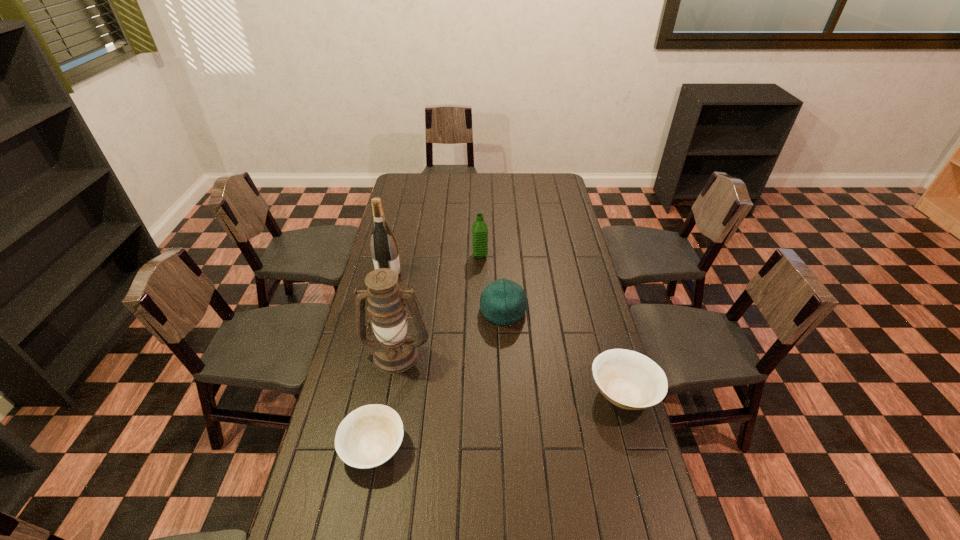
You are a GUI agent. You are given a task and a screenshot of the screen. Output one action in this format:
    pyautogui.click(x=<x>, y=<y>)
    Task: Click on the vacant space located 0.310m on the right of the shorter bowl
    
    Given the screenshot: What is the action you would take?
    pyautogui.click(x=516, y=448)

Where is `free space located on the back of the taller bowl`? This screenshot has width=960, height=540. free space located on the back of the taller bowl is located at coordinates tap(592, 285).

The image size is (960, 540). Identify the location of vacant space situated on the label of the fifth nearest object. (479, 275).

Find the location of a particular element. This screenshot has width=960, height=540. free space located on the left of the farthest object is located at coordinates (385, 255).

At what (x,y) coordinates should I click in order to perform the action: click on vacant area situated on the right of the fourth tallest object. Please return your answer as a coordinate pair (x, y). Image resolution: width=960 pixels, height=540 pixels. Looking at the image, I should click on (589, 311).

Locate an element on the screen. free spot located on the right of the oil lamp is located at coordinates (483, 353).

Find the location of a particular element. This screenshot has width=960, height=540. bowl situated at the left edge is located at coordinates (369, 436).

Find the location of a particular element. This screenshot has height=540, width=960. wine bottle situated at the left edge is located at coordinates coord(384,249).

Locate an element on the screen. oil lamp at the left edge is located at coordinates (395, 351).

Locate an element on the screen. This screenshot has height=540, width=960. object that is at the right edge is located at coordinates (630, 380).